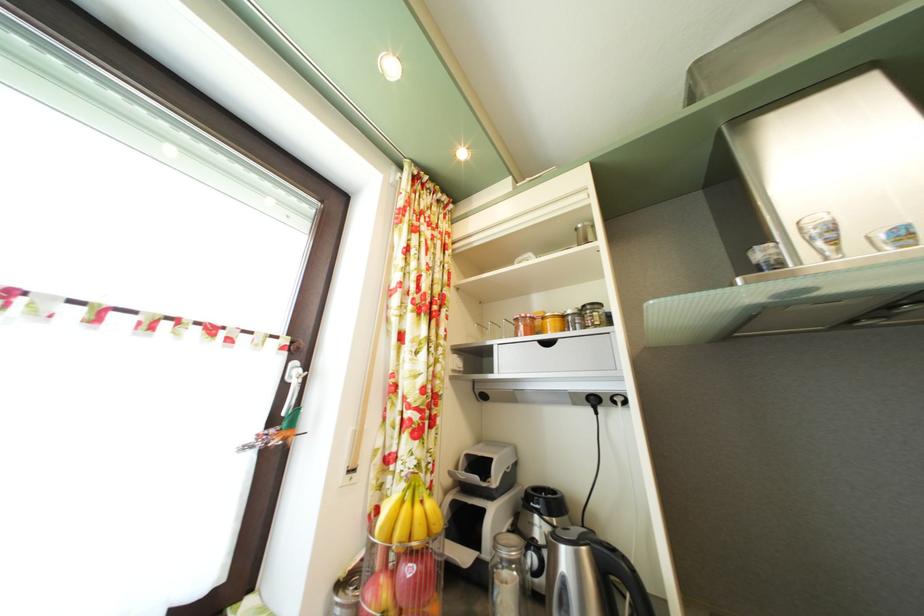
In order to click on orange mango in this screenshot , I will do `click(405, 554)`.